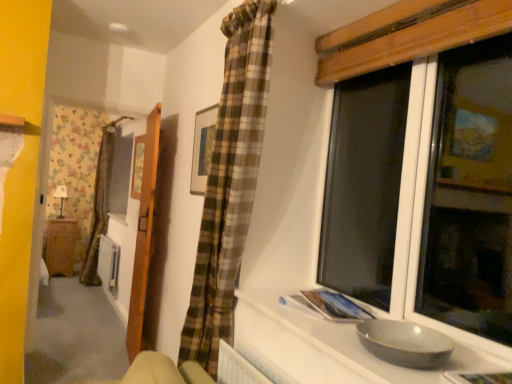
Question: In the image, is wooden picture frame at upper center, which is the first picture frame from back to front, positioned in front of or behind gray matte bowl at lower right?

Choices:
 (A) front
 (B) behind

Answer: (B)

Question: From a real-world perspective, is wooden picture frame at upper center, which is the first picture frame from back to front, above or below gray matte bowl at lower right?

Choices:
 (A) below
 (B) above

Answer: (B)

Question: Which object is the farthest from the matte black lamp at left?

Choices:
 (A) wooden door at left
 (B) wooden cabinet at left
 (C) wooden picture frame at upper center, marked as the first picture frame in a left-to-right arrangement
 (D) gray matte bowl at lower right
 (E) wooden framed picture at upper center, the second picture frame positioned from the left

Answer: (D)

Question: Which object is the closest to the wooden picture frame at upper center, which is the first picture frame from back to front?

Choices:
 (A) gray matte bowl at lower right
 (B) wooden door at left
 (C) matte black lamp at left
 (D) wooden cabinet at left
 (E) wooden framed picture at upper center, the first picture frame viewed from the right

Answer: (B)